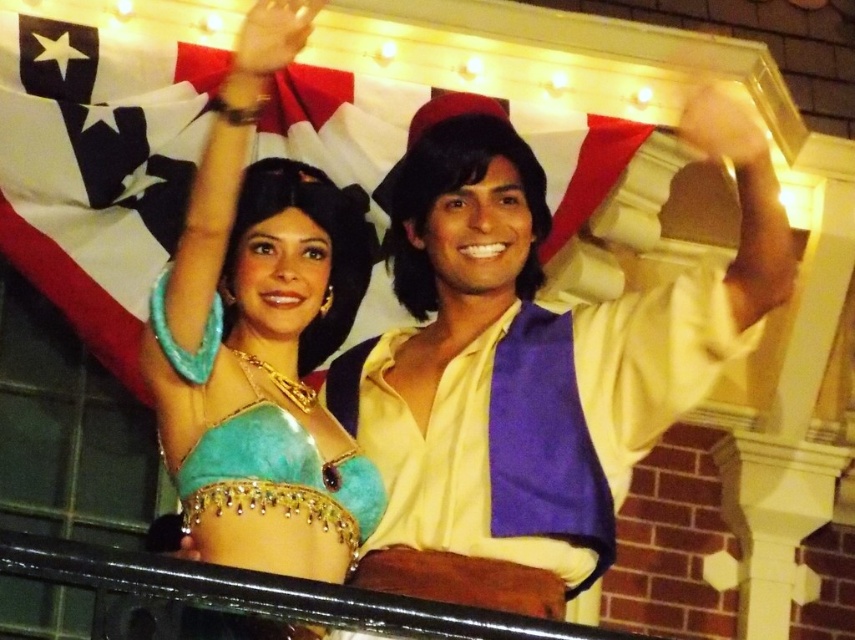
Question: Which point is closer to the camera taking this photo?

Choices:
 (A) (712, 124)
 (B) (323, 129)

Answer: (A)

Question: Which object is closer to the camera taking this photo?

Choices:
 (A) turquoise felt belly dancer costume at upper left
 (B) white fabric flag at upper center
 (C) yellow satin shirt at center

Answer: (A)

Question: Which point is closer to the camera?

Choices:
 (A) (688, 340)
 (B) (348, 540)
 (C) (140, 305)

Answer: (B)

Question: Considering the relative positions of white fabric flag at upper center and turquoise felt belly dancer costume at upper left in the image provided, where is white fabric flag at upper center located with respect to turquoise felt belly dancer costume at upper left?

Choices:
 (A) right
 (B) left

Answer: (A)

Question: Is yellow satin shirt at center in front of turquoise felt belly dancer costume at upper left?

Choices:
 (A) no
 (B) yes

Answer: (A)

Question: Can you confirm if yellow satin shirt at center is wider than turquoise felt belly dancer costume at upper left?

Choices:
 (A) no
 (B) yes

Answer: (B)